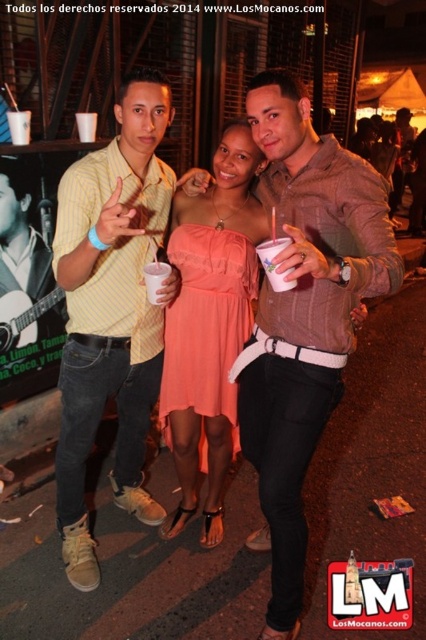
Measure the distance from brown textured shirt at center to pink plastic cup at center.

brown textured shirt at center and pink plastic cup at center are 24.94 inches apart.

Which is behind, point (333, 308) or point (160, 276)?

The point (160, 276) is behind.

In order to click on brown textured shirt at center in this screenshot , I will do `click(305, 316)`.

Does brown textured shirt at center have a lesser height compared to matte coral dress at center?

In fact, brown textured shirt at center may be taller than matte coral dress at center.

Is brown textured shirt at center wider than matte coral dress at center?

No.

You are a GUI agent. You are given a task and a screenshot of the screen. Output one action in this format:
    pyautogui.click(x=<x>, y=<y>)
    Task: Click on the brown textured shirt at center
    The width and height of the screenshot is (426, 640).
    Given the screenshot: What is the action you would take?
    pyautogui.click(x=305, y=316)

Is brown textured shirt at center above yellow striped shirt at center?

No, brown textured shirt at center is not above yellow striped shirt at center.

Where is `brown textured shirt at center`? This screenshot has height=640, width=426. brown textured shirt at center is located at coordinates (305, 316).